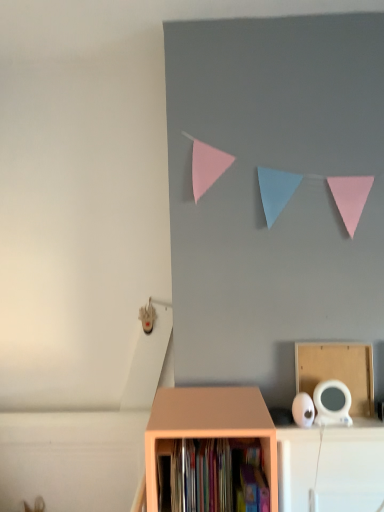
Question: From the image's perspective, does matte wood shelf at lower center appear lower than hardcover books at center?

Choices:
 (A) no
 (B) yes

Answer: (B)

Question: From a real-world perspective, is matte wood shelf at lower center located higher than hardcover books at center?

Choices:
 (A) yes
 (B) no

Answer: (B)

Question: From a real-world perspective, is matte wood shelf at lower center below hardcover books at center?

Choices:
 (A) yes
 (B) no

Answer: (A)

Question: Is matte wood shelf at lower center far from hardcover books at center?

Choices:
 (A) no
 (B) yes

Answer: (A)

Question: Does matte wood shelf at lower center have a smaller size compared to hardcover books at center?

Choices:
 (A) no
 (B) yes

Answer: (A)

Question: Is the depth of matte wood shelf at lower center less than that of hardcover books at center?

Choices:
 (A) yes
 (B) no

Answer: (A)

Question: From a real-world perspective, is cardboard at upper right on matte wood shelf at lower center?

Choices:
 (A) yes
 (B) no

Answer: (A)

Question: Does cardboard at upper right have a larger size compared to matte wood shelf at lower center?

Choices:
 (A) no
 (B) yes

Answer: (A)

Question: From a real-world perspective, is cardboard at upper right below matte wood shelf at lower center?

Choices:
 (A) yes
 (B) no

Answer: (B)

Question: Can you confirm if cardboard at upper right is wider than matte wood shelf at lower center?

Choices:
 (A) no
 (B) yes

Answer: (A)

Question: Is cardboard at upper right at the left side of matte wood shelf at lower center?

Choices:
 (A) no
 (B) yes

Answer: (A)

Question: Does cardboard at upper right have a smaller size compared to matte wood shelf at lower center?

Choices:
 (A) yes
 (B) no

Answer: (A)

Question: Does matte wood shelf at lower center have a lesser height compared to cardboard at upper right?

Choices:
 (A) no
 (B) yes

Answer: (A)